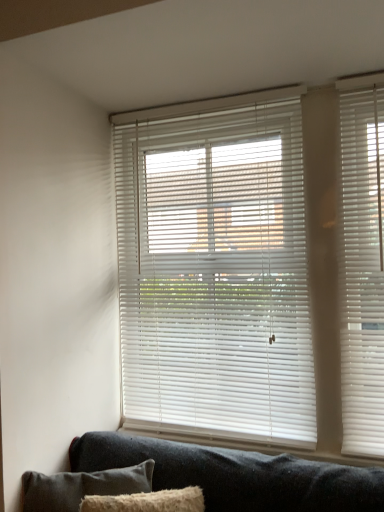
Question: Based on their positions, is dark gray fabric pillow at lower left located to the left or right of white plastic blinds at center?

Choices:
 (A) left
 (B) right

Answer: (A)

Question: Is point (64, 472) positioned closer to the camera than point (218, 374)?

Choices:
 (A) farther
 (B) closer

Answer: (B)

Question: Is dark gray fabric pillow at lower left in front of or behind white plastic blinds at center in the image?

Choices:
 (A) front
 (B) behind

Answer: (A)

Question: In terms of size, does white plastic blinds at center appear bigger or smaller than dark gray fabric pillow at lower left?

Choices:
 (A) big
 (B) small

Answer: (A)

Question: In terms of width, does white plastic blinds at center look wider or thinner when compared to dark gray fabric pillow at lower left?

Choices:
 (A) thin
 (B) wide

Answer: (A)

Question: Is white plastic blinds at center in front of or behind dark gray fabric pillow at lower left in the image?

Choices:
 (A) behind
 (B) front

Answer: (A)

Question: From a real-world perspective, relative to dark gray fabric pillow at lower left, is white plastic blinds at center vertically above or below?

Choices:
 (A) below
 (B) above

Answer: (B)